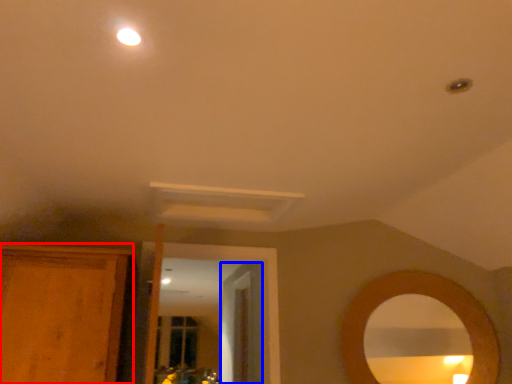
Question: Which object appears closest to the camera in this image, cabinetry (highlighted by a red box) or door (highlighted by a blue box)?

Choices:
 (A) cabinetry
 (B) door

Answer: (A)